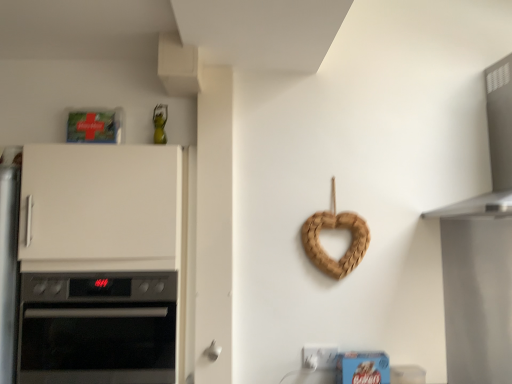
Question: Looking at the image, does braided wood heart at center-right seem bigger or smaller compared to white matte cabinet at left?

Choices:
 (A) big
 (B) small

Answer: (B)

Question: In the image, is braided wood heart at center-right on the left side or the right side of white matte cabinet at left?

Choices:
 (A) left
 (B) right

Answer: (B)

Question: Which is nearer to the white matte door handle at lower center?

Choices:
 (A) black glass oven at left
 (B) satin silver vent at upper right
 (C) white matte cabinet at left
 (D) braided wood heart at center-right

Answer: (A)

Question: Which object is the farthest from the satin silver vent at upper right?

Choices:
 (A) black glass oven at left
 (B) braided wood heart at center-right
 (C) white matte cabinet at left
 (D) white matte door handle at lower center

Answer: (A)